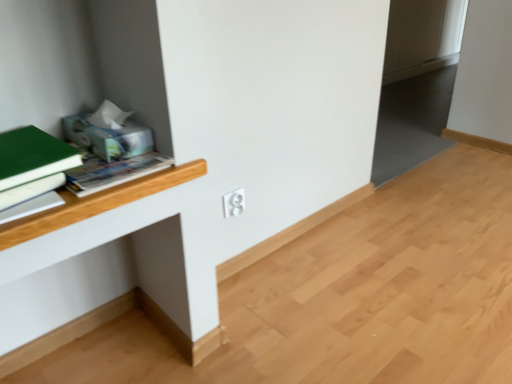
Question: Is white matte computer desk at center wider than green matte book at left?

Choices:
 (A) yes
 (B) no

Answer: (B)

Question: Can you confirm if white matte computer desk at center is positioned to the left of green matte book at left?

Choices:
 (A) yes
 (B) no

Answer: (B)

Question: Is white matte computer desk at center to the right of green matte book at left from the viewer's perspective?

Choices:
 (A) yes
 (B) no

Answer: (A)

Question: Is white matte computer desk at center not within green matte book at left?

Choices:
 (A) yes
 (B) no

Answer: (A)

Question: From the image's perspective, is white matte computer desk at center located beneath green matte book at left?

Choices:
 (A) no
 (B) yes

Answer: (B)

Question: Is white matte computer desk at center oriented towards green matte book at left?

Choices:
 (A) no
 (B) yes

Answer: (A)

Question: Would you consider green matte book at left to be distant from white plastic electric outlet at center?

Choices:
 (A) yes
 (B) no

Answer: (B)

Question: Could you tell me if green matte book at left is turned towards white plastic electric outlet at center?

Choices:
 (A) yes
 (B) no

Answer: (B)

Question: Is green matte book at left positioned behind white plastic electric outlet at center?

Choices:
 (A) yes
 (B) no

Answer: (B)

Question: Is green matte book at left wider than white plastic electric outlet at center?

Choices:
 (A) no
 (B) yes

Answer: (B)

Question: Is green matte book at left in front of white plastic electric outlet at center?

Choices:
 (A) no
 (B) yes

Answer: (B)

Question: Is green matte book at left placed right next to white plastic electric outlet at center?

Choices:
 (A) yes
 (B) no

Answer: (B)

Question: Is white plastic electric outlet at center to the right of white matte book at left from the viewer's perspective?

Choices:
 (A) no
 (B) yes

Answer: (B)